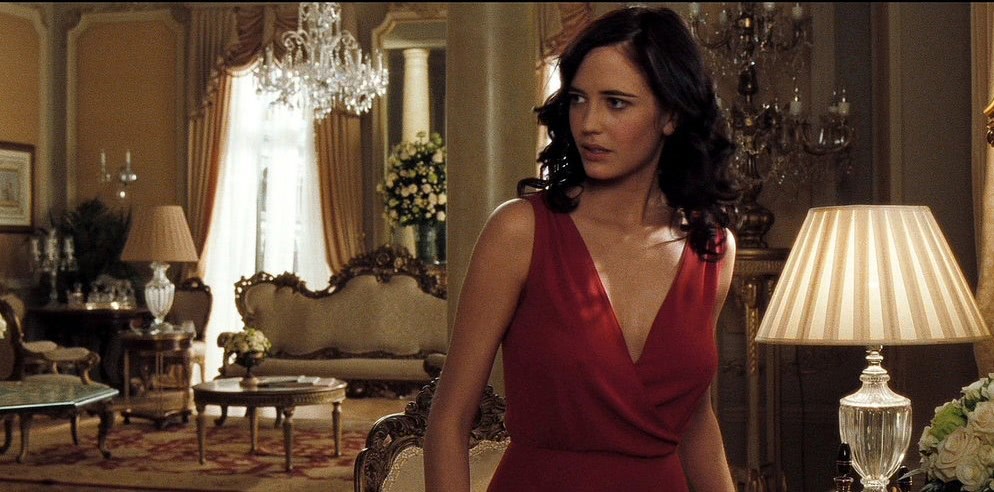
Identify the location of chandelier. (759, 61), (773, 129), (326, 70).